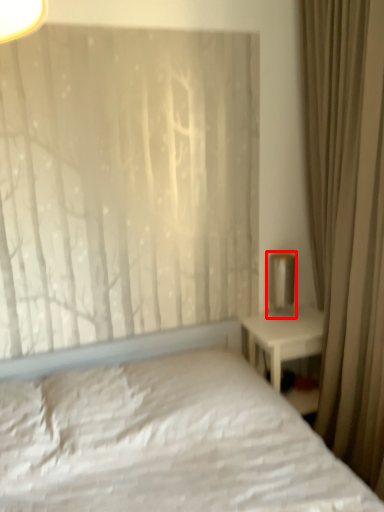
Question: Observing the image, what is the correct spatial positioning of table lamp (annotated by the red box) in reference to curtain?

Choices:
 (A) right
 (B) left

Answer: (B)